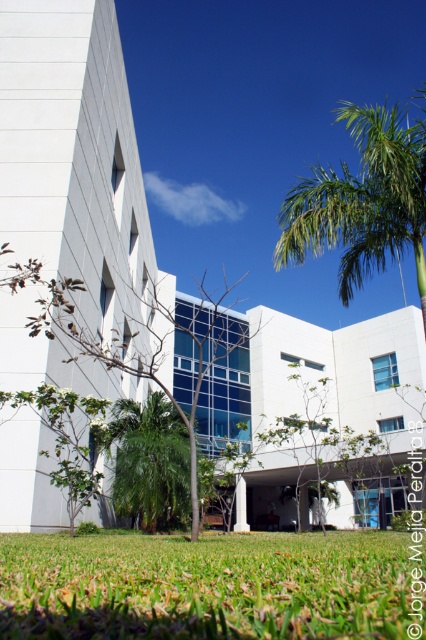
Does point (37, 284) lie in front of point (127, 426)?

Yes, point (37, 284) is in front of point (127, 426).

Does point (66, 310) come farther from viewer compared to point (146, 500)?

No, it is not.

Who is more distant from viewer, (x=192, y=401) or (x=141, y=470)?

The point (x=141, y=470) is more distant.

This screenshot has height=640, width=426. I want to click on green leafy tree at center, so click(115, 348).

Is green grass at lower center closer to camera compared to green leafy palm tree at center?

Yes.

From the picture: Who is positioned more to the left, green grass at lower center or green leafy palm tree at center?

From the viewer's perspective, green leafy palm tree at center appears more on the left side.

This screenshot has width=426, height=640. What are the coordinates of `green grass at lower center` in the screenshot? It's located at (206, 586).

Does point (284, 580) come behind point (5, 400)?

No, it is not.

What do you see at coordinates (206, 586) in the screenshot?
I see `green grass at lower center` at bounding box center [206, 586].

Does point (288, 618) come in front of point (114, 330)?

Yes, it is in front of point (114, 330).

Image resolution: width=426 pixels, height=640 pixels. In order to click on green grass at lower center in this screenshot , I will do `click(206, 586)`.